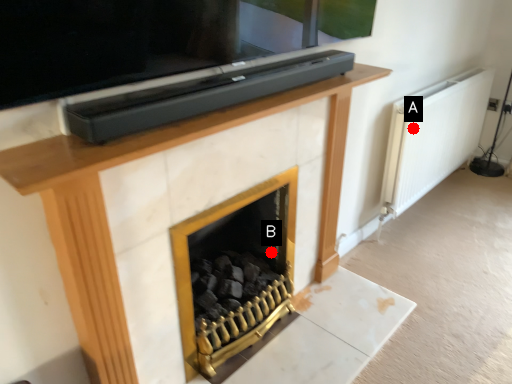
Question: Two points are circled on the image, labeled by A and B beside each circle. Which point appears closest to the camera in this image?

Choices:
 (A) A is closer
 (B) B is closer

Answer: (B)